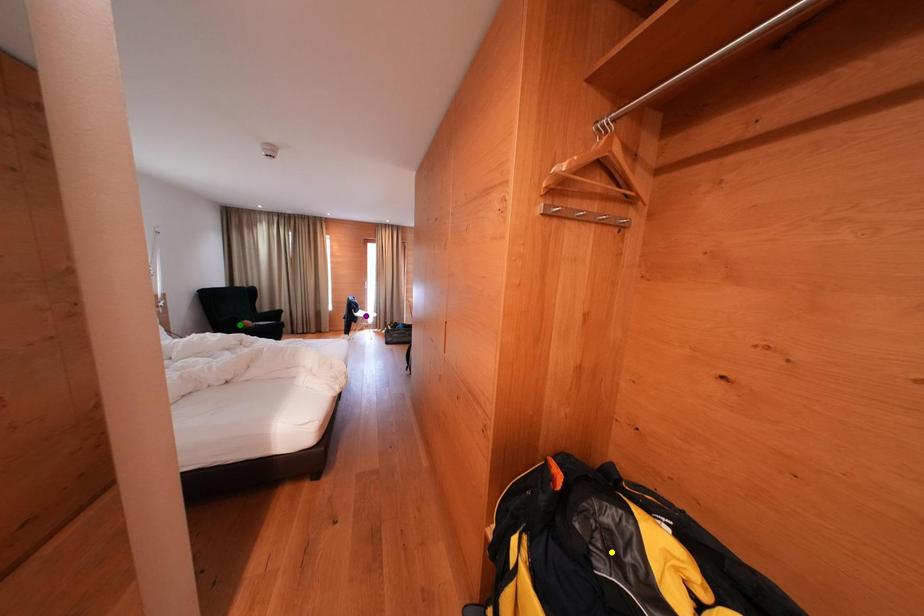
Order these from nearest to farthest:
A) green point
B) purple point
C) yellow point

1. yellow point
2. green point
3. purple point